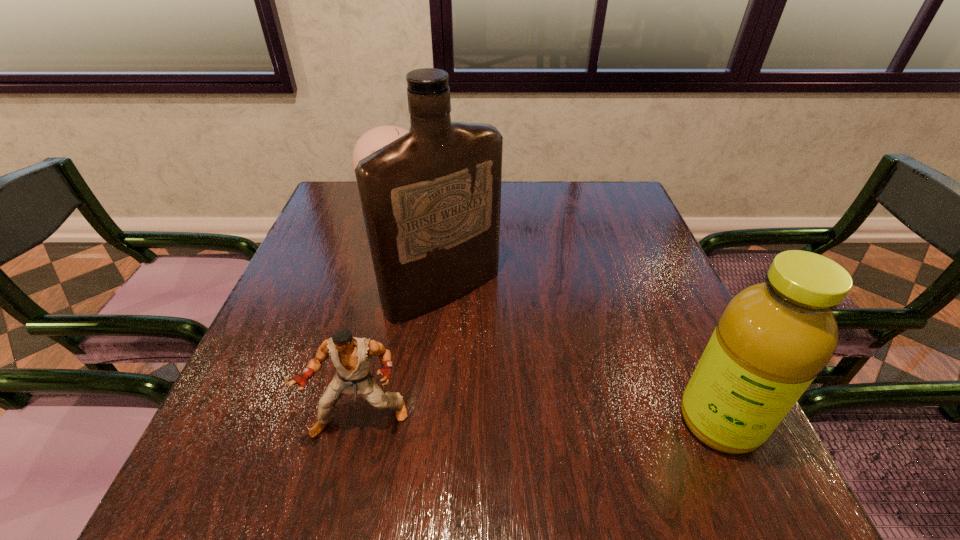
Locate an element on the screen. The height and width of the screenshot is (540, 960). free space on the desktop that is between the puncher and the fruit juice and is positioned on the label side of the tallest object is located at coordinates (573, 421).

The height and width of the screenshot is (540, 960). What are the coordinates of `free space on the desktop that is between the puncher and the fruit juice and is positioned at the snout of the farthest object` in the screenshot? It's located at coord(539,421).